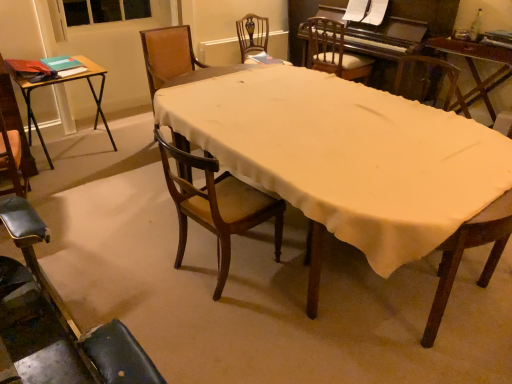
Question: Does wooden chair with ornate backrest at center, the first chair viewed from the back, have a larger size compared to wooden table at center, which appears as the 2th table when viewed from the left?

Choices:
 (A) no
 (B) yes

Answer: (A)

Question: Is wooden table at center, which appears as the 2th table when viewed from the left, inside wooden chair with ornate backrest at center, the first chair viewed from the back?

Choices:
 (A) no
 (B) yes

Answer: (A)

Question: Are wooden chair with ornate backrest at center, the first chair viewed from the back, and wooden table at center, which is the 1th table in right-to-left order, located far from each other?

Choices:
 (A) yes
 (B) no

Answer: (A)

Question: Can you confirm if wooden chair with ornate backrest at center, the first chair viewed from the back, is positioned to the right of wooden table at center, which appears as the 2th table when viewed from the left?

Choices:
 (A) yes
 (B) no

Answer: (B)

Question: Is wooden chair with ornate backrest at center, the fifth chair in the front-to-back sequence, touching wooden table at center, which appears as the 2th table when viewed from the left?

Choices:
 (A) yes
 (B) no

Answer: (B)

Question: Is point (24, 317) positioned closer to the camera than point (478, 21)?

Choices:
 (A) closer
 (B) farther

Answer: (A)

Question: From a real-world perspective, relative to green glass bottle at upper right, is leather seat at lower left, which is counted as the first chair, starting from the front, vertically above or below?

Choices:
 (A) below
 (B) above

Answer: (A)

Question: Based on their positions, is leather seat at lower left, which is counted as the first chair, starting from the front, located to the left or right of green glass bottle at upper right?

Choices:
 (A) right
 (B) left

Answer: (B)

Question: In terms of width, does leather seat at lower left, the fifth chair positioned from the back, look wider or thinner when compared to green glass bottle at upper right?

Choices:
 (A) wide
 (B) thin

Answer: (A)

Question: Considering their positions, is wooden table at center located in front of or behind wooden table at center, which is the 1th table in right-to-left order?

Choices:
 (A) behind
 (B) front

Answer: (B)

Question: From a real-world perspective, is wooden table at center positioned above or below wooden table at center, which is the 1th table in right-to-left order?

Choices:
 (A) below
 (B) above

Answer: (A)

Question: From the image's perspective, is wooden table at center positioned above or below wooden table at center, which is the 1th table in right-to-left order?

Choices:
 (A) above
 (B) below

Answer: (B)

Question: Choose the correct answer: Is wooden table at center inside wooden table at center, which is the 1th table in right-to-left order, or outside it?

Choices:
 (A) inside
 (B) outside

Answer: (B)

Question: Looking at the image, does green glass bottle at upper right seem bigger or smaller compared to wooden chair at upper center, positioned as the 2th chair in back-to-front order?

Choices:
 (A) small
 (B) big

Answer: (A)

Question: Is green glass bottle at upper right in front of or behind wooden chair at upper center, positioned as the 2th chair in back-to-front order, in the image?

Choices:
 (A) front
 (B) behind

Answer: (A)